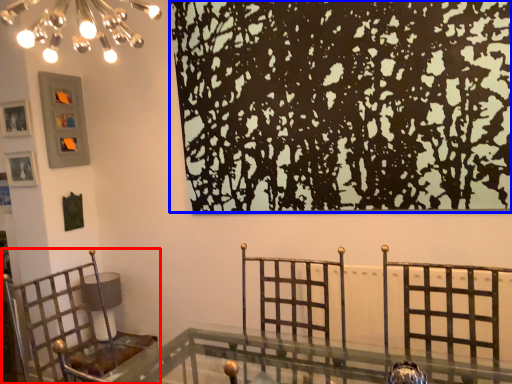
Question: Which of the following is the farthest to the observer, furniture (highlighted by a red box) or tree (highlighted by a blue box)?

Choices:
 (A) furniture
 (B) tree

Answer: (B)